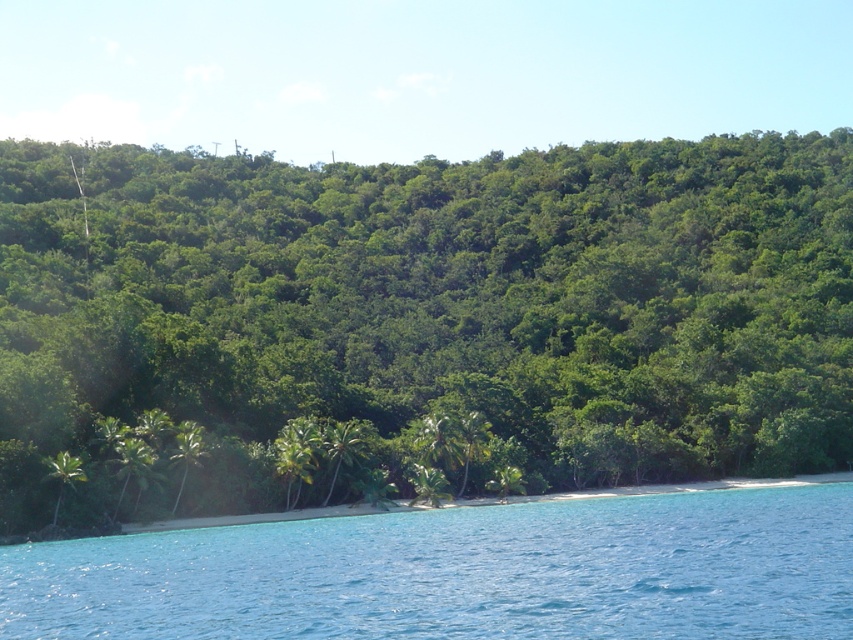
You are standing at the shoreline in this tropical coastal scene. You notice the green leafy trees at lower center and the clear blue water at lower center. Which of these two features occupies a larger area in the scene?

The green leafy trees at lower center might be wider than clear blue water at lower center, so they likely occupy a larger area in the scene.

In the scene shown: You are standing on the beach and want to walk to the green leafy palm tree at lower left. The clear blue water at lower center is in your path. Based on their heights, can you step over the water to reach the tree?

The clear blue water at lower center is taller than the green leafy palm tree at lower left, so you cannot step over the water because it is higher than the tree.

Based on the photo, you are standing at the point labeled point (573, 449) and want to reach the beach. The distance between you and the beach is 320.86 feet. If you can walk at a speed of 3 feet per second, how many seconds will it take you to reach the beach?

The distance between you and the beach is 320.86 feet. At a walking speed of 3 feet per second, it will take approximately 107 seconds to reach the beach.